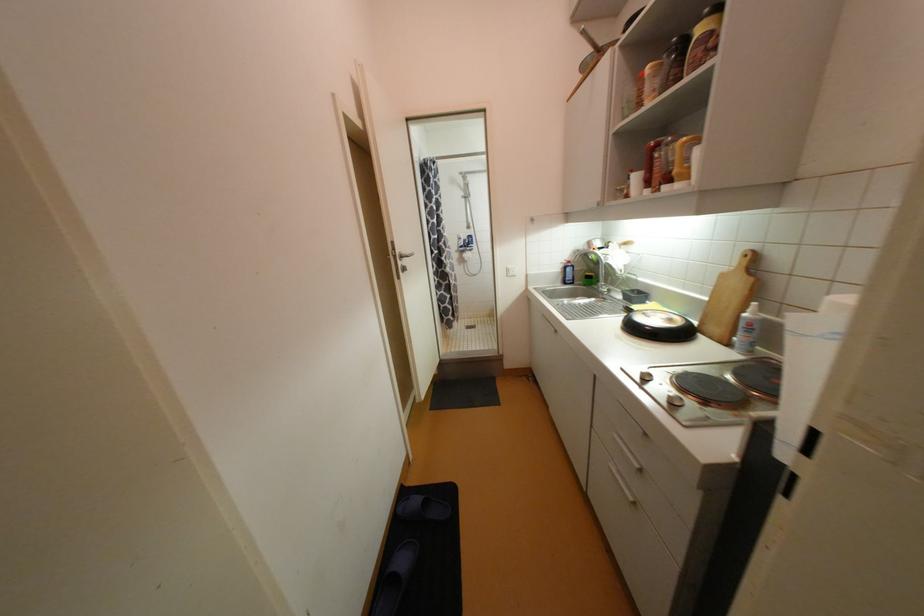
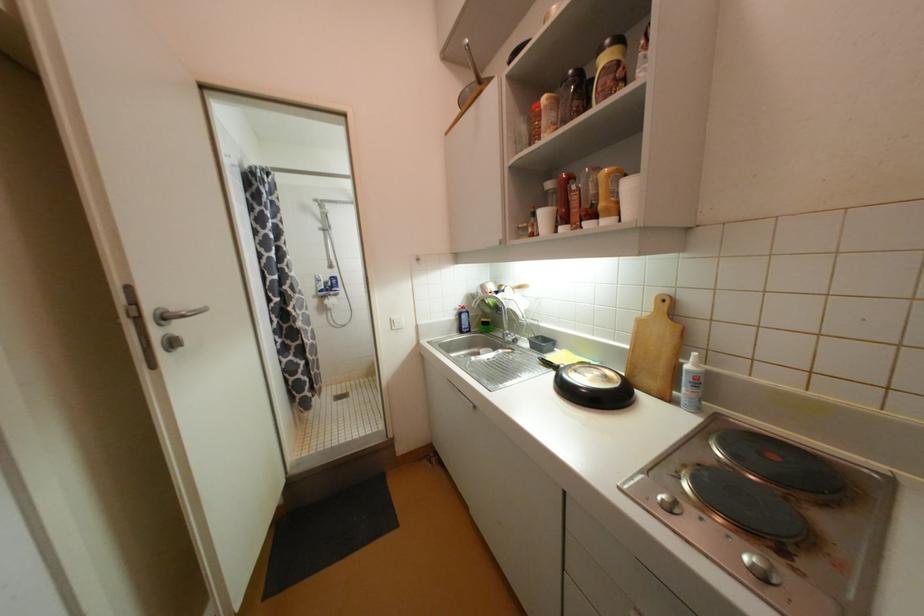
The point at (412, 257) is marked in the first image. Where is the corresponding point in the second image?

(188, 318)